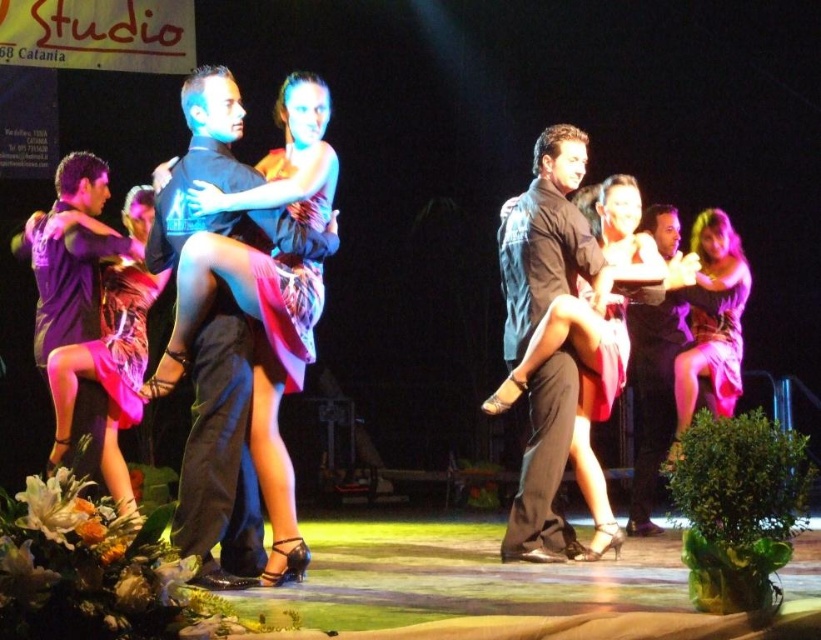
Question: Does black smooth shirt at center appear under pink satin dress at left?

Choices:
 (A) yes
 (B) no

Answer: (B)

Question: Where is black satin suit at center located in relation to pink satin dress at left in the image?

Choices:
 (A) above
 (B) below

Answer: (A)

Question: Considering the real-world distances, which object is farthest from the pink satin dress at left?

Choices:
 (A) black satin suit at center
 (B) pink satin dress at right
 (C) black smooth shirt at center

Answer: (B)

Question: Which point is closer to the camera taking this photo?

Choices:
 (A) (709, 340)
 (B) (560, 193)
 (C) (190, 548)

Answer: (C)

Question: Which point is closer to the camera?

Choices:
 (A) (553, 218)
 (B) (134, 289)
 (C) (219, 228)

Answer: (C)

Question: Can you confirm if black smooth shirt at center is positioned above pink satin dress at left?

Choices:
 (A) no
 (B) yes

Answer: (B)